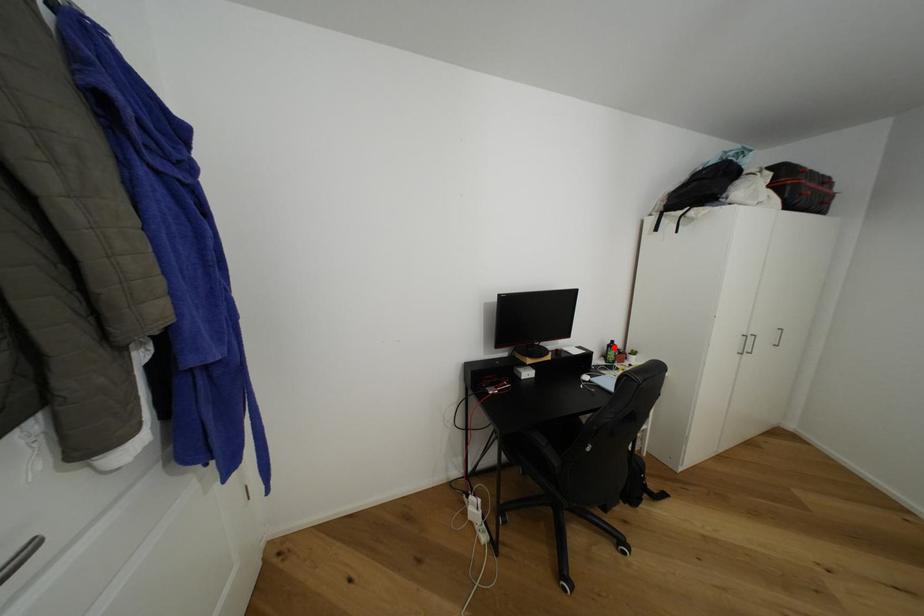
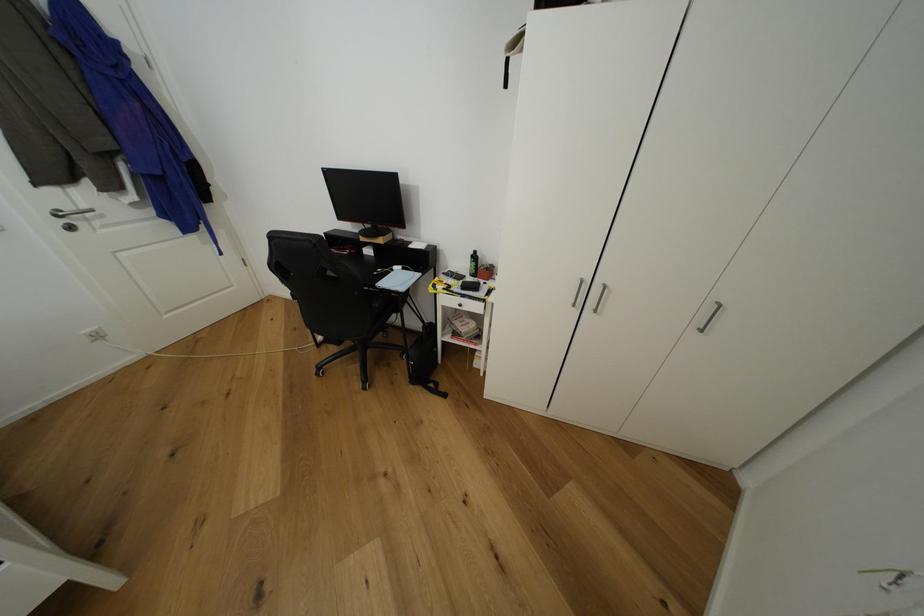
The point at the highlighted location is marked in the first image. Where is the corresponding point in the second image?

(478, 257)